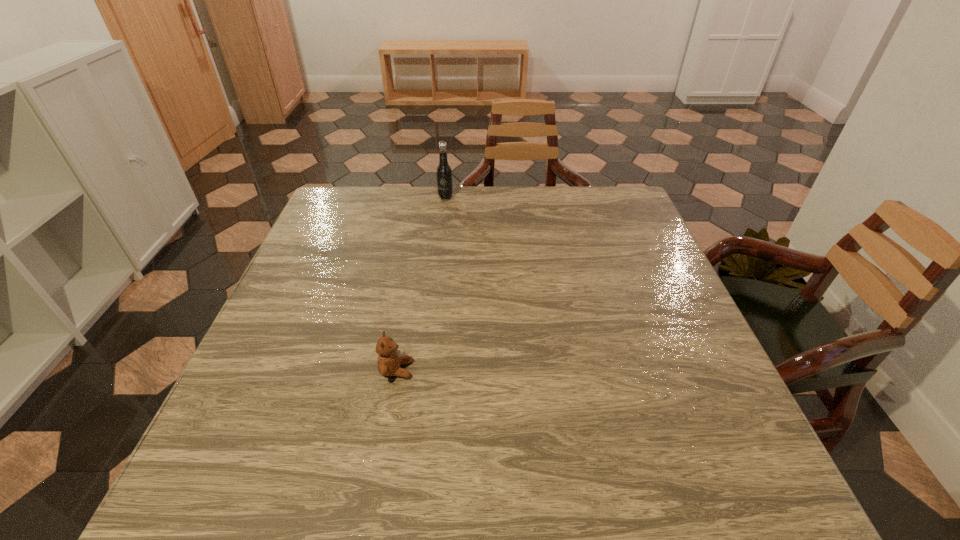
I want to click on root beer, so click(x=444, y=173).

Find the location of a particular element. This screenshot has height=540, width=960. the farther object is located at coordinates (444, 173).

Image resolution: width=960 pixels, height=540 pixels. I want to click on the left object, so click(x=389, y=363).

At what (x,y) coordinates should I click in order to perform the action: click on teddy bear. Please return your answer as a coordinate pair (x, y). Looking at the image, I should click on click(389, 363).

At what (x,y) coordinates should I click in order to perform the action: click on vacant space located on the label of the root beer. Please return your answer as a coordinate pair (x, y). Looking at the image, I should click on (436, 286).

Find the location of a particular element. This screenshot has height=540, width=960. vacant space located 0.370m on the face of the shorter object is located at coordinates click(597, 370).

Where is `object present at the far edge`? object present at the far edge is located at coordinates (444, 173).

In the image, there is a desktop. Where is `free region at the far edge`? The width and height of the screenshot is (960, 540). free region at the far edge is located at coordinates (560, 193).

The image size is (960, 540). Find the location of `vacant area at the left edge`. vacant area at the left edge is located at coordinates (287, 351).

This screenshot has height=540, width=960. I want to click on vacant space at the right edge of the desktop, so click(659, 284).